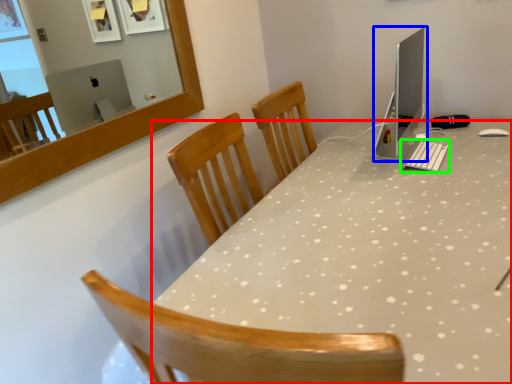
Question: Considering the real-world distances, which object is farthest from desk (highlighted by a red box)? computer monitor (highlighted by a blue box) or keyboard (highlighted by a green box)?

Choices:
 (A) computer monitor
 (B) keyboard

Answer: (A)